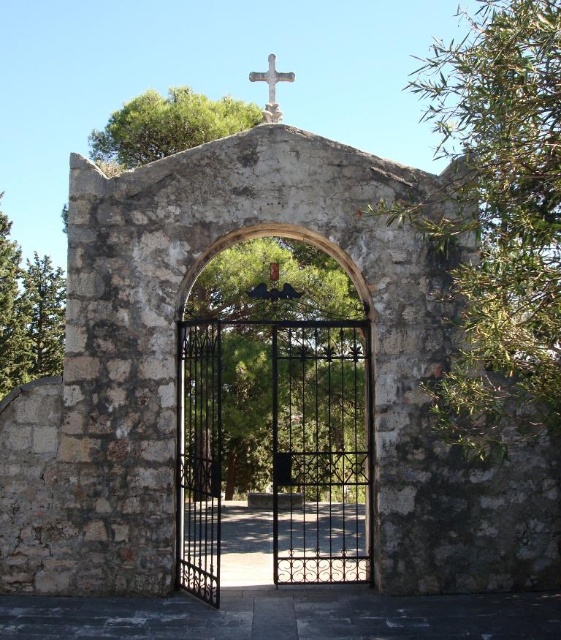
Question: Among these points, which one is farthest from the camera?

Choices:
 (A) (301, 554)
 (B) (266, 106)

Answer: (B)

Question: Can you confirm if black wrought iron gate at center is thinner than white stone cross at upper center?

Choices:
 (A) yes
 (B) no

Answer: (B)

Question: Can you confirm if black wrought iron gate at center is positioned to the left of white stone cross at upper center?

Choices:
 (A) no
 (B) yes

Answer: (A)

Question: Which of the following is the closest to the observer?

Choices:
 (A) white stone cross at upper center
 (B) black wrought iron gate at center

Answer: (B)

Question: Can you confirm if black wrought iron gate at center is positioned above white stone cross at upper center?

Choices:
 (A) no
 (B) yes

Answer: (A)